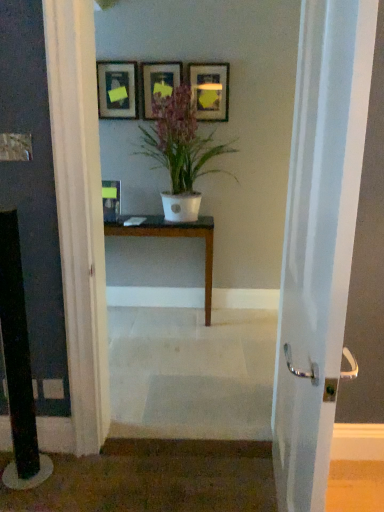
You are a GUI agent. You are given a task and a screenshot of the screen. Output one action in this format:
    pyautogui.click(x=<x>, y=<y>)
    Task: Click on the vacant space in front of dark brown wood table at center
    The height and width of the screenshot is (512, 384).
    Given the screenshot: What is the action you would take?
    pyautogui.click(x=170, y=349)